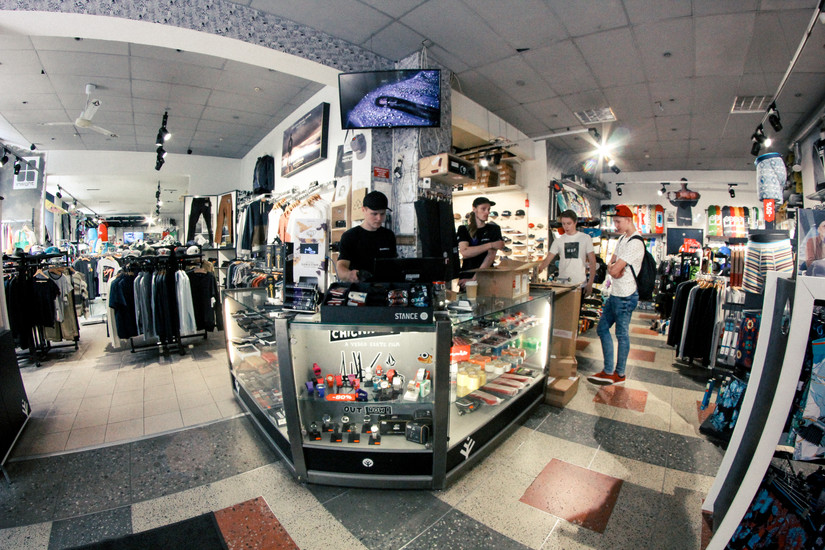
Locate an element on the screen. This screenshot has height=550, width=825. corner counter on glass display counter is located at coordinates (364, 316).